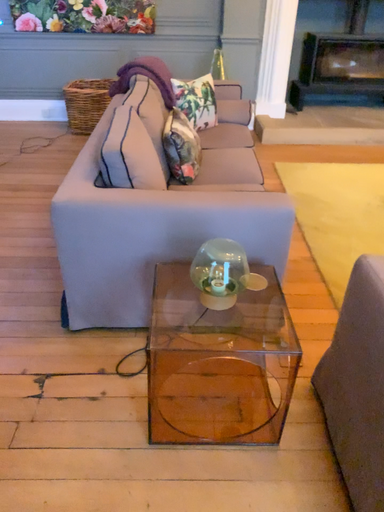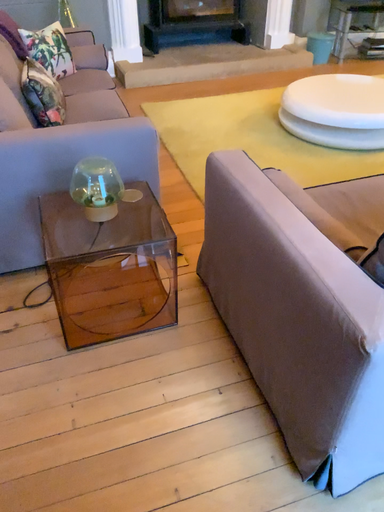
Question: How did the camera likely rotate when shooting the video?

Choices:
 (A) rotated right
 (B) rotated left

Answer: (A)